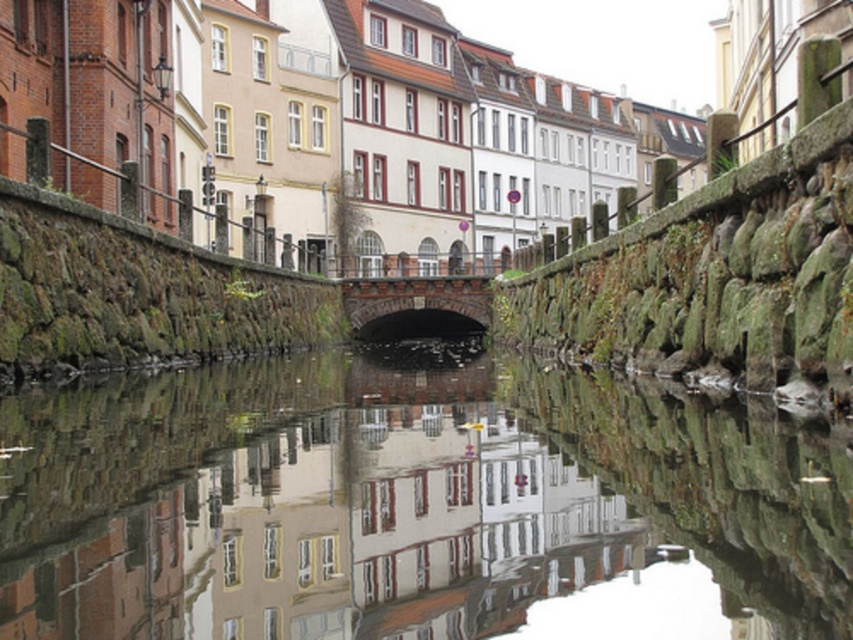
Does smooth reflective water at center appear over dark brown stone bridge at center?

Incorrect, smooth reflective water at center is not positioned above dark brown stone bridge at center.

Find the location of a particular element. This screenshot has width=853, height=640. smooth reflective water at center is located at coordinates click(x=416, y=509).